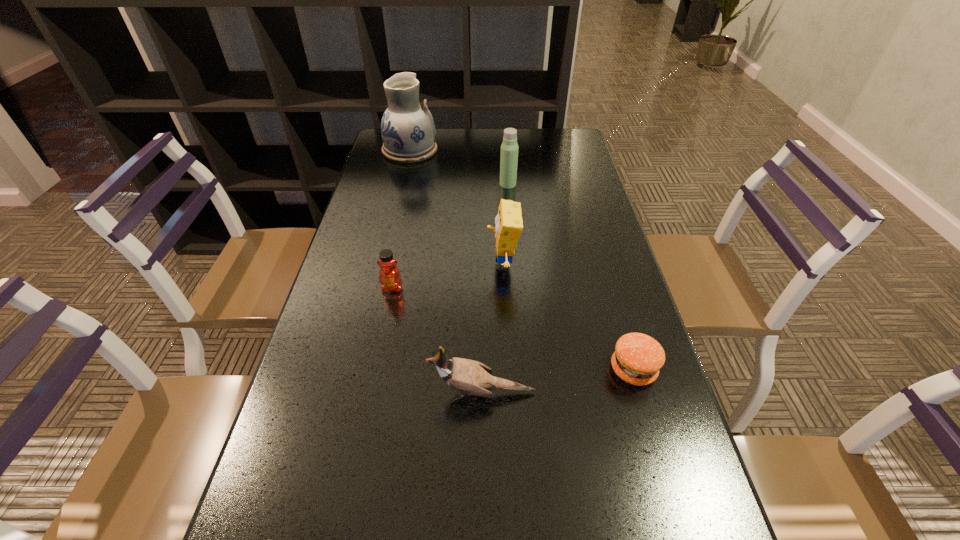
At what (x,y) coordinates should I click in order to perform the action: click on blank space located 0.220m on the face of the sponge. Please return your answer as a coordinate pair (x, y). The image size is (960, 540). Looking at the image, I should click on (402, 264).

This screenshot has height=540, width=960. Identify the location of vacant space located on the face of the sponge. (421, 264).

Find the location of a particular element. This screenshot has width=960, height=540. free space located on the face of the sponge is located at coordinates (456, 264).

Where is `free location located 0.190m at the face of the bird`? The width and height of the screenshot is (960, 540). free location located 0.190m at the face of the bird is located at coordinates (334, 393).

You are a GUI agent. You are given a task and a screenshot of the screen. Output one action in this format:
    pyautogui.click(x=<x>, y=<y>)
    Task: Click on the free space located at the face of the bird
    
    Given the screenshot: What is the action you would take?
    click(x=395, y=393)

Identify the location of free spot located 0.280m on the front label of the fifth tallest object. (370, 398).

You are a GUI agent. You are given a task and a screenshot of the screen. Output one action in this format:
    pyautogui.click(x=<x>, y=<y>)
    Task: Click on the free space located on the left of the patty
    Image resolution: width=960 pixels, height=540 pixels.
    Given the screenshot: What is the action you would take?
    pyautogui.click(x=533, y=369)

Identify the location of object located at the far edge. (408, 130).

Locate an element on the screen. This screenshot has width=960, height=540. pottery that is positioned at the left edge is located at coordinates point(408,130).

The image size is (960, 540). Identify the location of honey that is positioned at the left edge. (389, 276).